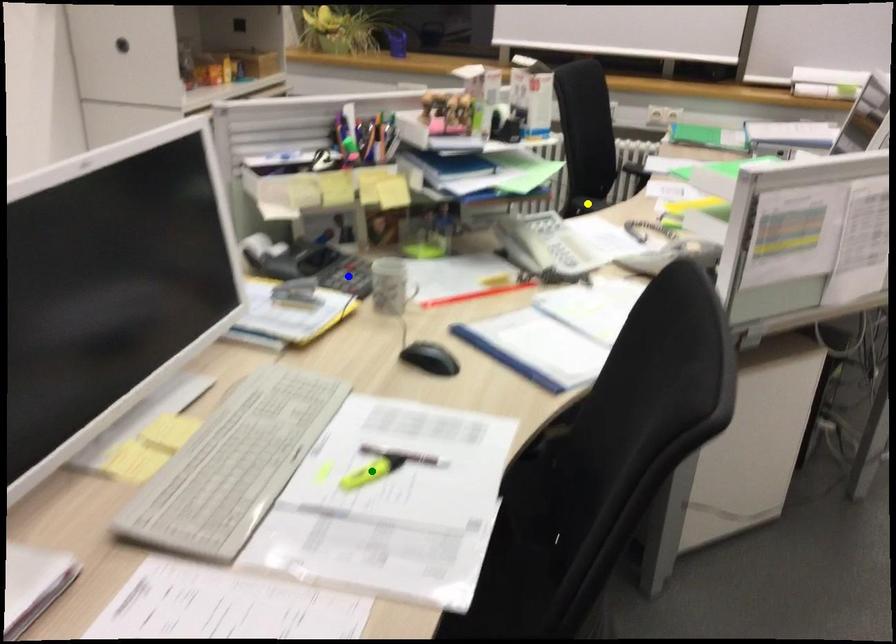
Order these from nearest to farthest:
- green point
- blue point
- yellow point

yellow point → blue point → green point